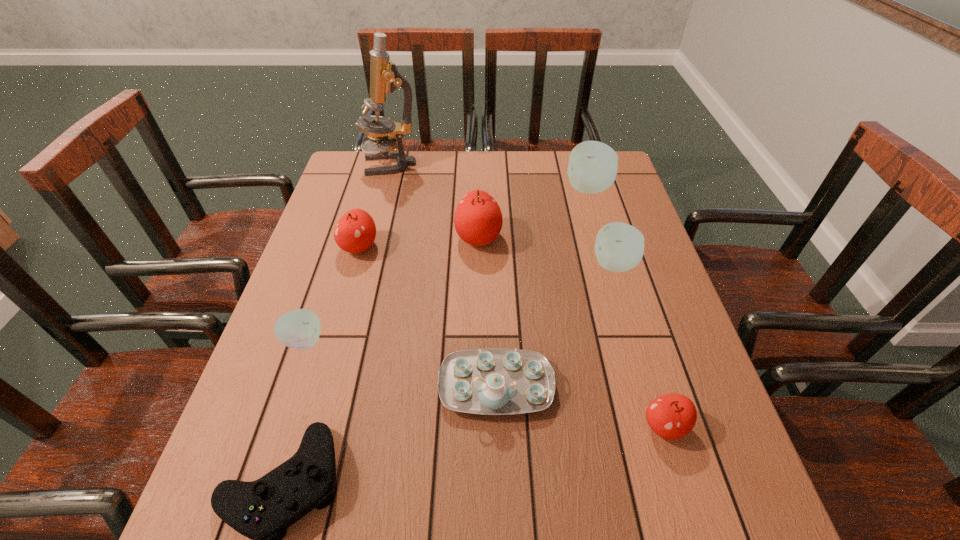
The width and height of the screenshot is (960, 540). I want to click on microscope situated at the far edge, so click(x=385, y=78).

This screenshot has height=540, width=960. I want to click on apple located at the far edge, so click(x=592, y=168).

Find the location of a particular element. microscope located at the left edge is located at coordinates (385, 78).

You are a GUI agent. You are given a task and a screenshot of the screen. Output one action in this format:
    pyautogui.click(x=<x>, y=<y>)
    Task: Click on the object present at the far left corner
    This screenshot has height=540, width=960.
    Given the screenshot: What is the action you would take?
    pyautogui.click(x=385, y=78)

Identify the location of object situated at the far right corner. The height and width of the screenshot is (540, 960). (592, 168).

At what (x,y) coordinates should I click in order to perform the action: click on vacant space at the far edge of the desktop. Please return your answer as a coordinate pair (x, y). This screenshot has width=960, height=540. Looking at the image, I should click on (476, 157).

Where is `free spot at the left edge of the desktop`? This screenshot has width=960, height=540. free spot at the left edge of the desktop is located at coordinates (249, 460).

In the image, there is a desktop. Find the location of `free space at the right edge`. free space at the right edge is located at coordinates (618, 211).

In the image, there is a desktop. Where is `vacant region at the far right corner`? vacant region at the far right corner is located at coordinates (621, 174).

Locate an element on the screen. The width and height of the screenshot is (960, 540). free space at the near right corner of the desktop is located at coordinates (698, 504).